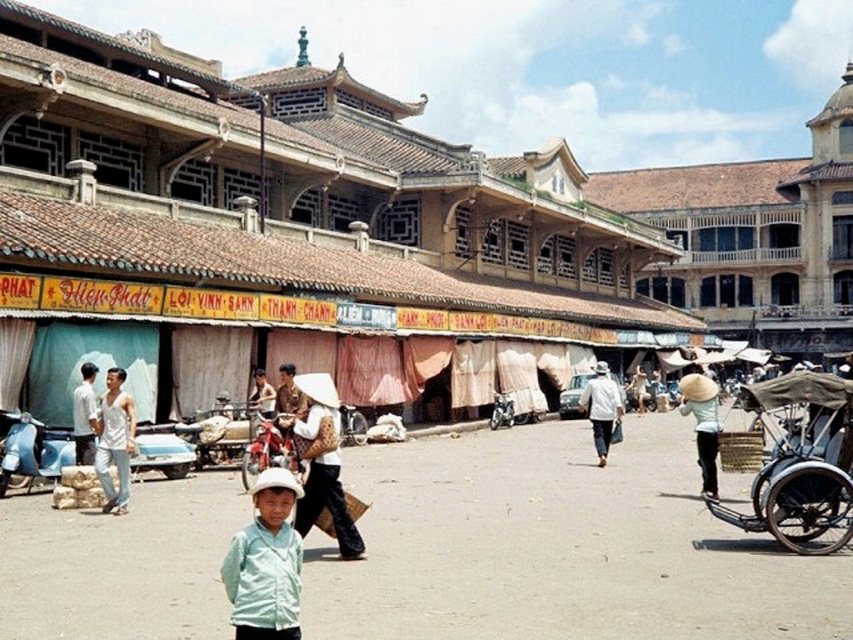
Question: Which object is positioned farthest from the white cotton hat at center?

Choices:
 (A) white cotton tank top at left
 (B) light blue shirt at center

Answer: (A)

Question: Is the position of light blue shirt at center less distant than that of light brown woven hat at center?

Choices:
 (A) no
 (B) yes

Answer: (B)

Question: Is wooden cart at right positioned before light blue shirt at center?

Choices:
 (A) no
 (B) yes

Answer: (B)

Question: Which object appears farthest from the camera in this image?

Choices:
 (A) light brown fabric hat at center
 (B) light beige straw hat at center

Answer: (A)

Question: Is matte white conical hat at center to the left of light blue shirt at center from the viewer's perspective?

Choices:
 (A) no
 (B) yes

Answer: (A)

Question: Which of the following is the closest to the observer?

Choices:
 (A) (302, 385)
 (B) (705, 456)
 (C) (602, 458)
 (D) (646, 387)

Answer: (A)